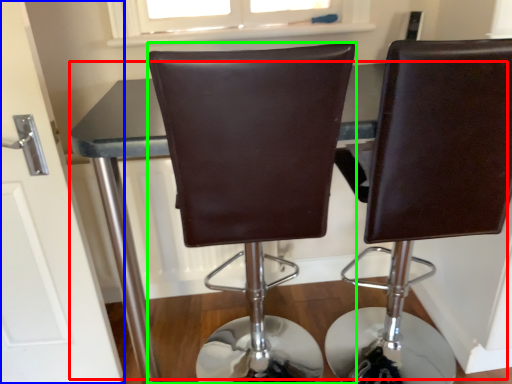
Question: Which object is the farthest from table (highlighted by a red box)? Choose among these: door (highlighted by a blue box) or chair (highlighted by a green box).

Choices:
 (A) door
 (B) chair

Answer: (B)